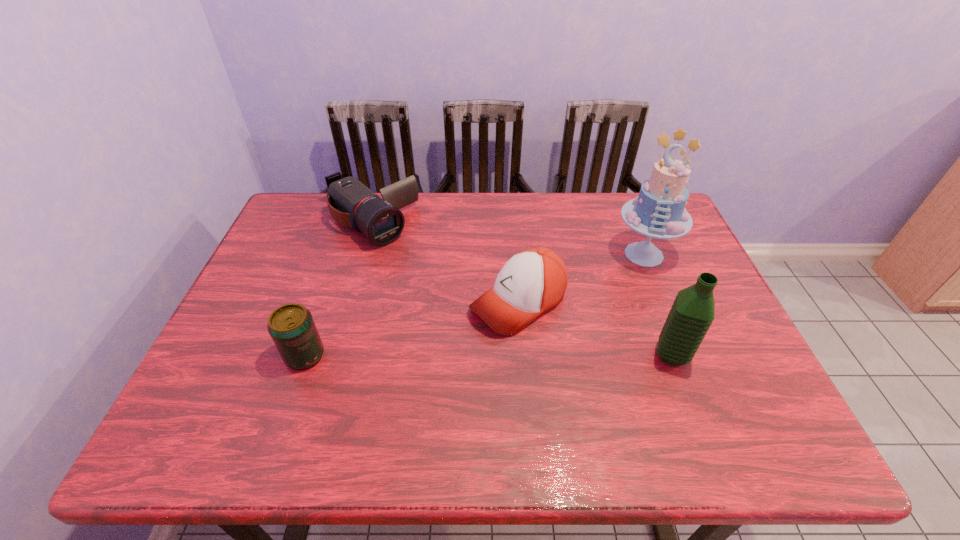
The width and height of the screenshot is (960, 540). Identify the location of vacant space on the desktop that is between the beer can and the water bottle and is positioned on the front-facing side of the baseball cap. (436, 356).

Where is `free space on the desktop that is between the beer can and the water bottle and is positioned on the lens of the camcorder`? The width and height of the screenshot is (960, 540). free space on the desktop that is between the beer can and the water bottle and is positioned on the lens of the camcorder is located at coordinates (519, 355).

Locate an element on the screen. free spot on the desktop that is between the beer can and the water bottle and is positioned with a ladder on the side of the tallest object is located at coordinates (508, 355).